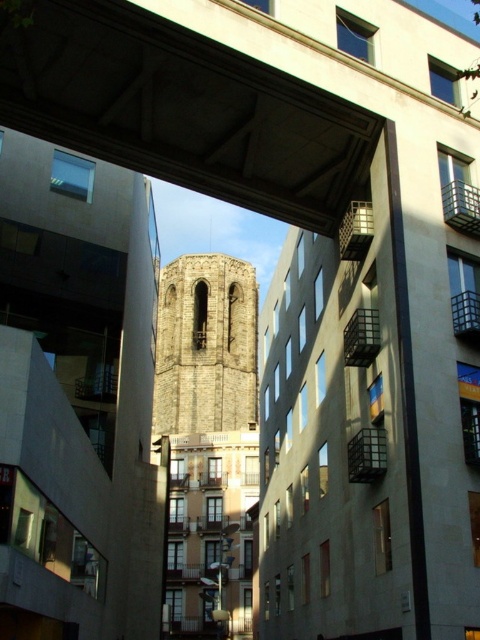
Question: Among these points, which one is nearest to the camera?

Choices:
 (A) [x=186, y=93]
 (B) [x=252, y=288]

Answer: (A)

Question: Can you confirm if concrete at center is wider than brown stone bell tower at center?

Choices:
 (A) yes
 (B) no

Answer: (B)

Question: Can you confirm if concrete at center is thinner than brown stone bell tower at center?

Choices:
 (A) no
 (B) yes

Answer: (B)

Question: Does concrete at center have a lesser width compared to brown stone bell tower at center?

Choices:
 (A) no
 (B) yes

Answer: (B)